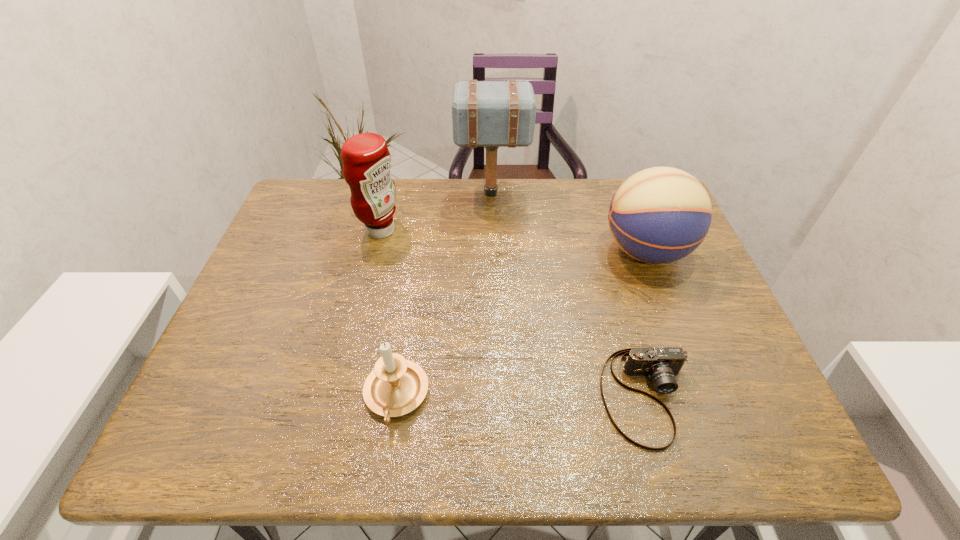
The width and height of the screenshot is (960, 540). In order to click on mallet in this screenshot , I will do `click(491, 114)`.

At what (x,y) coordinates should I click in order to perform the action: click on the farthest object. Please return your answer as a coordinate pair (x, y). The width and height of the screenshot is (960, 540). Looking at the image, I should click on (491, 114).

This screenshot has height=540, width=960. Identify the location of condiment. (366, 159).

At what (x,y) coordinates should I click in order to perform the action: click on basketball. Please return your answer as a coordinate pair (x, y). The width and height of the screenshot is (960, 540). Looking at the image, I should click on (659, 215).

Where is `candle holder`? candle holder is located at coordinates (396, 386).

Locate an element on the screen. The width and height of the screenshot is (960, 540). the shortest object is located at coordinates (661, 365).

Locate an element on the screen. free spot located on the striking surface of the third object from left to right is located at coordinates (368, 193).

Where is `blank area located 0.390m on the striking surface of the third object from left to right`? Image resolution: width=960 pixels, height=540 pixels. blank area located 0.390m on the striking surface of the third object from left to right is located at coordinates (333, 193).

Find the location of `free location located on the striking surface of the third object from left to right`. free location located on the striking surface of the third object from left to right is located at coordinates (396, 193).

Identify the location of free location located 0.240m on the left of the condiment. (278, 230).